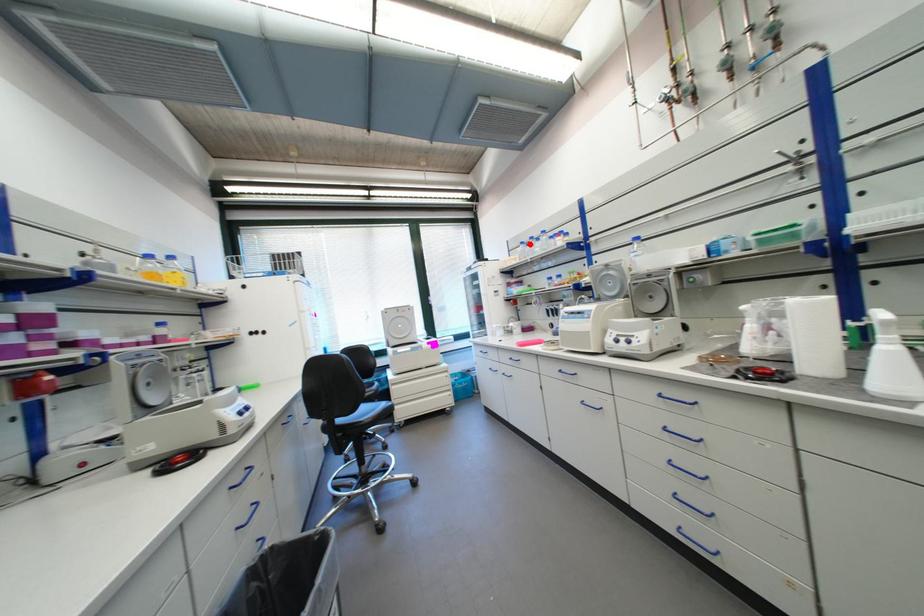
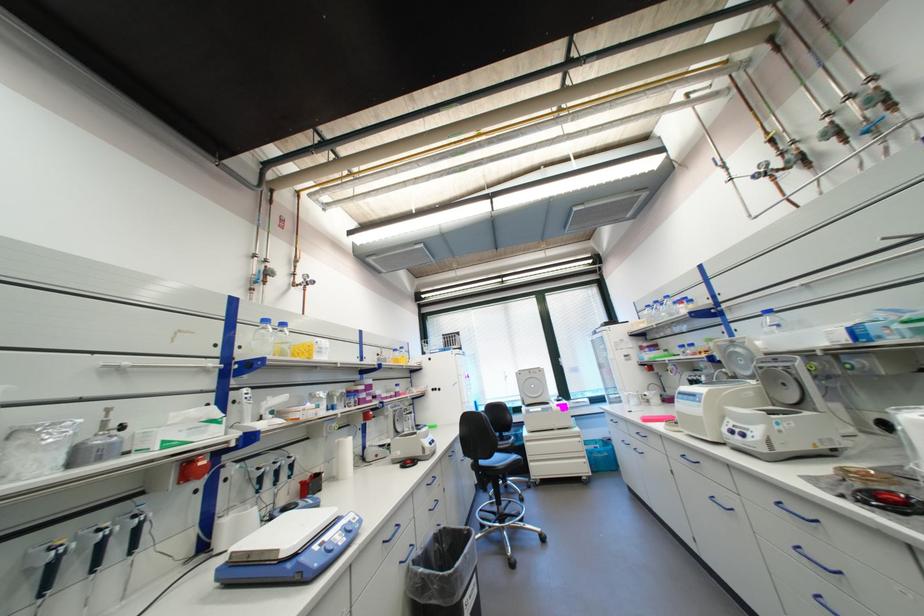
Find the pixel in the second image that matches the highlighted location in the first image.

(655, 307)